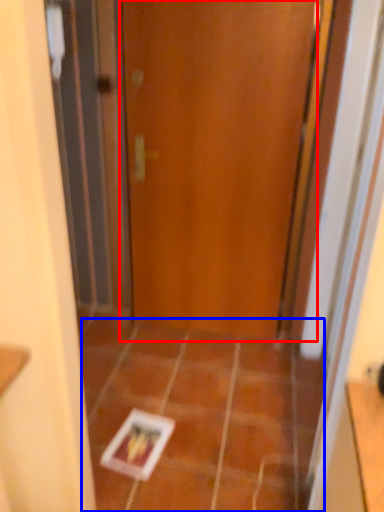
Question: Which point is closer to the camera, door (highlighted by a red box) or ceramic tile (highlighted by a blue box)?

Choices:
 (A) door
 (B) ceramic tile

Answer: (B)